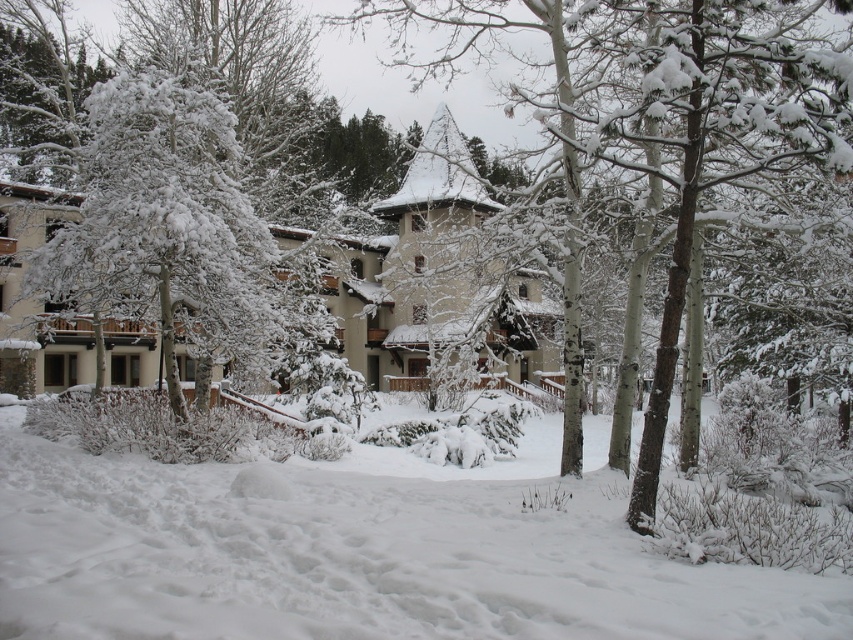
Measure the distance between white fluffy snow at center and camera.

The distance of white fluffy snow at center from camera is 14.04 feet.

Does white fluffy snow at center have a greater height compared to snow-covered tree at center?

Incorrect, white fluffy snow at center's height is not larger of snow-covered tree at center's.

Is point (199, 628) positioned after point (842, 106)?

No, (199, 628) is closer to viewer.

Locate an element on the screen. The image size is (853, 640). white fluffy snow at center is located at coordinates (358, 554).

I want to click on white fluffy snow at center, so click(x=358, y=554).

Is point (235, 467) closer to camera compared to point (115, 172)?

That is True.

This screenshot has height=640, width=853. I want to click on white fluffy snow at center, so click(x=358, y=554).

The height and width of the screenshot is (640, 853). What are the coordinates of `white fluffy snow at center` in the screenshot? It's located at (358, 554).

Between snow-covered tree at center and white snow-covered tree at left, which one has more height?

Standing taller between the two is snow-covered tree at center.

Which is behind, point (630, 140) or point (173, 257)?

The point (173, 257) is behind.

The height and width of the screenshot is (640, 853). Identify the location of snow-covered tree at center. (669, 115).

The height and width of the screenshot is (640, 853). Identify the location of snow-covered tree at center. (669, 115).